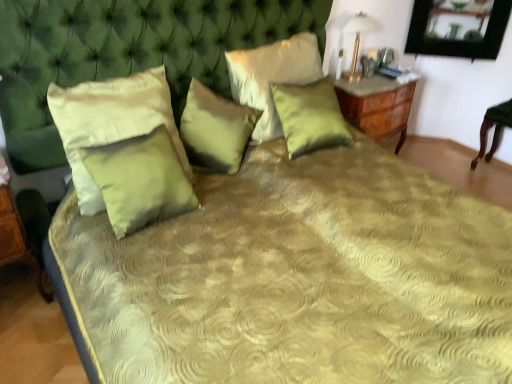
Where is `wooden nightstand at right`? wooden nightstand at right is located at coordinates (377, 108).

Identify the location of wooden table at lower left. (17, 239).

Identify the location of gold metallic table lamp at upper right. (358, 40).

Image resolution: width=512 pixels, height=384 pixels. Identify the location of satin green pillow at upper center, placed as the 4th pillow when sorted from left to right. (272, 76).

The height and width of the screenshot is (384, 512). Describe the element at coordinates (310, 116) in the screenshot. I see `green satin pillow at upper center, which is the 5th pillow in left-to-right order` at that location.

The height and width of the screenshot is (384, 512). What are the coordinates of `satin green pillow at center, positioned as the third pillow in left-to-right order` in the screenshot? It's located at (215, 129).

Is green satin pillow at upper center, the first pillow in the right-to-left sequence, completely or partially outside of matte green pillow at left, arranged as the 1th pillow when viewed from the left?

Yes, green satin pillow at upper center, the first pillow in the right-to-left sequence, is outside of matte green pillow at left, arranged as the 1th pillow when viewed from the left.

How distant is green satin pillow at upper center, which is the 5th pillow in left-to-right order, from matte green pillow at left, the fifth pillow viewed from the right?

green satin pillow at upper center, which is the 5th pillow in left-to-right order, is 31.08 inches away from matte green pillow at left, the fifth pillow viewed from the right.

Is green satin pillow at upper center, which is the 5th pillow in left-to-right order, shorter than matte green pillow at left, arranged as the 1th pillow when viewed from the left?

Correct, green satin pillow at upper center, which is the 5th pillow in left-to-right order, is not as tall as matte green pillow at left, arranged as the 1th pillow when viewed from the left.

Which is correct: satin green pillow at center, the fourth pillow viewed from the right, is inside wooden table at lower left, or outside of it?

satin green pillow at center, the fourth pillow viewed from the right, lies outside wooden table at lower left.

Considering the relative sizes of satin green pillow at center, the fourth pillow viewed from the right, and wooden table at lower left in the image provided, is satin green pillow at center, the fourth pillow viewed from the right, wider than wooden table at lower left?

No, satin green pillow at center, the fourth pillow viewed from the right, is not wider than wooden table at lower left.

Measure the distance from satin green pillow at center, the second pillow in the left-to-right sequence, to wooden table at lower left.

The distance of satin green pillow at center, the second pillow in the left-to-right sequence, from wooden table at lower left is 25.19 inches.

Is satin green pillow at center, the second pillow in the left-to-right sequence, with wooden table at lower left?

There is a gap between satin green pillow at center, the second pillow in the left-to-right sequence, and wooden table at lower left.

Measure the distance between satin green pillow at upper center, placed as the 4th pillow when sorted from left to right, and wooden nightstand at right.

A distance of 24.20 inches exists between satin green pillow at upper center, placed as the 4th pillow when sorted from left to right, and wooden nightstand at right.

Is satin green pillow at upper center, which is counted as the second pillow, starting from the right, in front of or behind wooden nightstand at right in the image?

Clearly, satin green pillow at upper center, which is counted as the second pillow, starting from the right, is in front of wooden nightstand at right.

From the image's perspective, is satin green pillow at upper center, placed as the 4th pillow when sorted from left to right, positioned above or below wooden nightstand at right?

Clearly, from the image's perspective, satin green pillow at upper center, placed as the 4th pillow when sorted from left to right, is above wooden nightstand at right.

Based on the photo, from a real-world perspective, is satin green pillow at upper center, which is counted as the second pillow, starting from the right, positioned under wooden nightstand at right based on gravity?

No, from a real-world perspective, satin green pillow at upper center, which is counted as the second pillow, starting from the right, is not below wooden nightstand at right.

From the image's perspective, starting from the gold metallic table lamp at upper right, which pillow is the 3rd one below? Please provide its 2D coordinates.

[(215, 129)]

Is gold metallic table lamp at upper right turned away from satin green pillow at center, which is the 3th pillow from right to left?

gold metallic table lamp at upper right does not have its back to satin green pillow at center, which is the 3th pillow from right to left.

Is gold metallic table lamp at upper right taller than satin green pillow at center, which is the 3th pillow from right to left?

Yes, gold metallic table lamp at upper right is taller than satin green pillow at center, which is the 3th pillow from right to left.

Is point (354, 67) positioned before point (244, 121)?

No.

From the image's perspective, is satin green pillow at center, the second pillow in the left-to-right sequence, above wooden nightstand at right?

No.

Where is `nightstand directly beneath the satin green pillow at center, the second pillow in the left-to-right sequence (from a real-world perspective)`? This screenshot has width=512, height=384. nightstand directly beneath the satin green pillow at center, the second pillow in the left-to-right sequence (from a real-world perspective) is located at coordinates (377, 108).

From a real-world perspective, between satin green pillow at center, the fourth pillow viewed from the right, and wooden nightstand at right, who is vertically higher?

satin green pillow at center, the fourth pillow viewed from the right, is physically above.

Considering the points (278, 65) and (137, 186), which point is behind, point (278, 65) or point (137, 186)?

The point (278, 65) is farther from the camera.

Is satin green pillow at upper center, placed as the 4th pillow when sorted from left to right, in front of or behind satin green pillow at center, the second pillow in the left-to-right sequence, in the image?

Clearly, satin green pillow at upper center, placed as the 4th pillow when sorted from left to right, is behind satin green pillow at center, the second pillow in the left-to-right sequence.

Consider the image. Could you tell me if satin green pillow at upper center, placed as the 4th pillow when sorted from left to right, is turned towards satin green pillow at center, the second pillow in the left-to-right sequence?

No, satin green pillow at upper center, placed as the 4th pillow when sorted from left to right, does not turn towards satin green pillow at center, the second pillow in the left-to-right sequence.

From a real-world perspective, is green satin pillow at upper center, which is the 5th pillow in left-to-right order, located beneath gold metallic table lamp at upper right?

Yes, from a real-world perspective, green satin pillow at upper center, which is the 5th pillow in left-to-right order, is below gold metallic table lamp at upper right.

Between green satin pillow at upper center, which is the 5th pillow in left-to-right order, and gold metallic table lamp at upper right, which one has larger width?

Wider between the two is gold metallic table lamp at upper right.

Is green satin pillow at upper center, which is the 5th pillow in left-to-right order, taller or shorter than gold metallic table lamp at upper right?

Considering their sizes, green satin pillow at upper center, which is the 5th pillow in left-to-right order, has more height than gold metallic table lamp at upper right.

Is gold metallic table lamp at upper right inside green satin pillow at upper center, the first pillow in the right-to-left sequence?

No, gold metallic table lamp at upper right is not surrounded by green satin pillow at upper center, the first pillow in the right-to-left sequence.

The height and width of the screenshot is (384, 512). What are the coordinates of `the 3rd pillow behind when counting from the matte green pillow at left, the fifth pillow viewed from the right` in the screenshot? It's located at (310, 116).

Locate an element on the screen. table below the satin green pillow at center, the second pillow in the left-to-right sequence (from a real-world perspective) is located at coordinates (17, 239).

Considering their positions, is wooden table at lower left positioned closer to gold metallic table lamp at upper right than green satin pillow at upper center, which is the 5th pillow in left-to-right order?

Based on the image, green satin pillow at upper center, which is the 5th pillow in left-to-right order, appears to be nearer to gold metallic table lamp at upper right.

Based on their spatial positions, is green satin pillow at upper center, which is the 5th pillow in left-to-right order, or wooden nightstand at right further from satin green pillow at center, the second pillow in the left-to-right sequence?

wooden nightstand at right is further to satin green pillow at center, the second pillow in the left-to-right sequence.

Looking at the image, which one is located closer to matte green pillow at left, the fifth pillow viewed from the right, gold metallic table lamp at upper right or satin green pillow at upper center, which is counted as the second pillow, starting from the right?

The object closer to matte green pillow at left, the fifth pillow viewed from the right, is satin green pillow at upper center, which is counted as the second pillow, starting from the right.

Estimate the real-world distances between objects in this image. Which object is further from satin green pillow at center, the second pillow in the left-to-right sequence, gold metallic table lamp at upper right or wooden nightstand at right?

gold metallic table lamp at upper right lies further to satin green pillow at center, the second pillow in the left-to-right sequence, than the other object.

When comparing their distances from satin green pillow at center, the second pillow in the left-to-right sequence, does matte green pillow at left, arranged as the 1th pillow when viewed from the left, or gold metallic table lamp at upper right seem further?

The object further to satin green pillow at center, the second pillow in the left-to-right sequence, is gold metallic table lamp at upper right.

Which object lies further to the anchor point gold metallic table lamp at upper right, matte green pillow at left, the fifth pillow viewed from the right, or wooden table at lower left?

wooden table at lower left is positioned further to the anchor gold metallic table lamp at upper right.

Which object lies further to the anchor point green satin pillow at upper center, the first pillow in the right-to-left sequence, satin green pillow at upper center, placed as the 4th pillow when sorted from left to right, or gold metallic table lamp at upper right?

gold metallic table lamp at upper right lies further to green satin pillow at upper center, the first pillow in the right-to-left sequence, than the other object.

Looking at the image, which one is located further to gold metallic table lamp at upper right, matte green pillow at left, the fifth pillow viewed from the right, or satin green pillow at center, the second pillow in the left-to-right sequence?

Based on the image, satin green pillow at center, the second pillow in the left-to-right sequence, appears to be further to gold metallic table lamp at upper right.

The image size is (512, 384). I want to click on pillow situated between satin green pillow at upper center, which is counted as the second pillow, starting from the right, and wooden nightstand at right from left to right, so click(x=310, y=116).

Image resolution: width=512 pixels, height=384 pixels. In order to click on table lamp located between green satin pillow at upper center, the first pillow in the right-to-left sequence, and wooden nightstand at right in the depth direction in this screenshot , I will do `click(358, 40)`.

Find the location of a particular element. Image resolution: width=512 pixels, height=384 pixels. pillow between satin green pillow at center, which is the 3th pillow from right to left, and green satin pillow at upper center, the first pillow in the right-to-left sequence, from left to right is located at coordinates (272, 76).

The width and height of the screenshot is (512, 384). What are the coordinates of `table lamp between satin green pillow at center, the second pillow in the left-to-right sequence, and wooden nightstand at right, in the horizontal direction` in the screenshot? It's located at (358, 40).